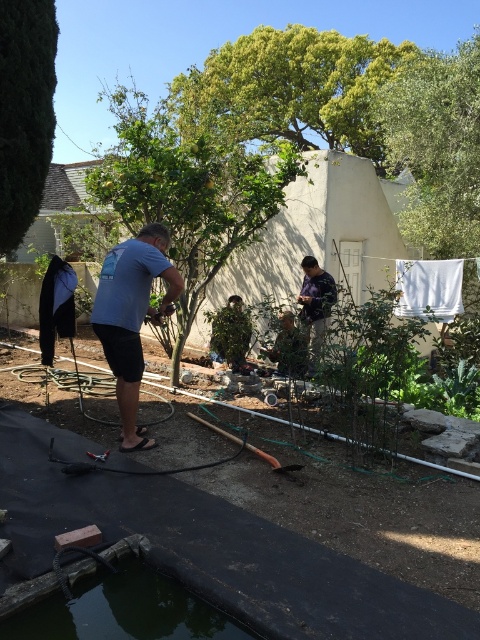
Question: Can you confirm if dark green rubber pond at bottom left is positioned above blue cotton shirt at center?

Choices:
 (A) yes
 (B) no

Answer: (B)

Question: Considering the real-world distances, which object is farthest from the camouflage shirt at center?

Choices:
 (A) dark green rubber pond at bottom left
 (B) blue cotton shirt at center

Answer: (A)

Question: Which of the following is the farthest from the observer?

Choices:
 (A) (333, 301)
 (B) (130, 596)
 (C) (123, 422)

Answer: (A)

Question: Which object is closer to the camera taking this photo?

Choices:
 (A) camouflage shirt at center
 (B) dark green rubber pond at bottom left

Answer: (B)

Question: Can you confirm if dark green rubber pond at bottom left is positioned to the left of blue cotton shirt at center?

Choices:
 (A) no
 (B) yes

Answer: (A)

Question: Is blue cotton shirt at center bigger than camouflage shirt at center?

Choices:
 (A) yes
 (B) no

Answer: (B)